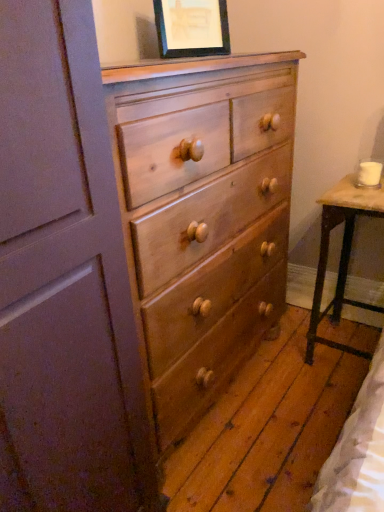
At what (x,y) coordinates should I click in order to perform the action: click on free point below wooden table at right (from a real-world perspective). Please return your answer as a coordinate pair (x, y). Looking at the image, I should click on (350, 346).